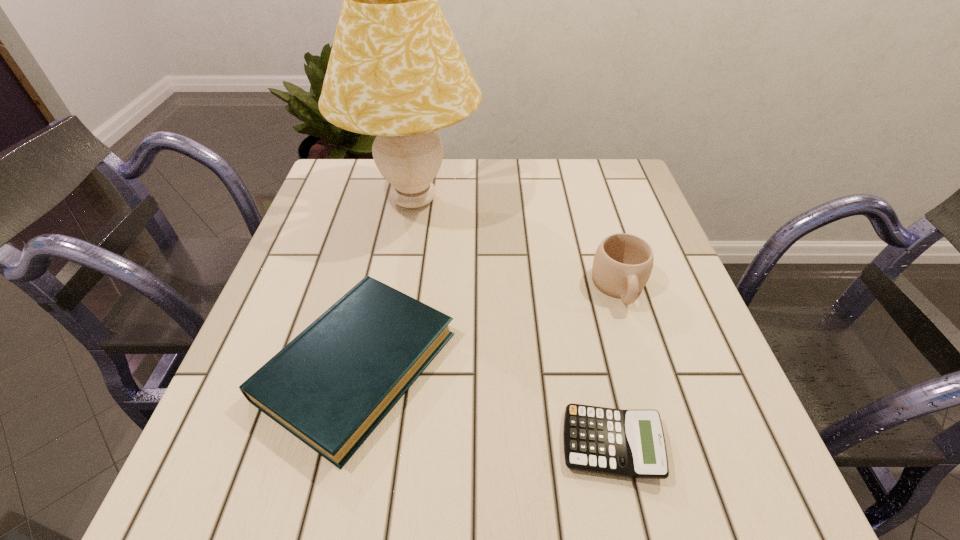
Where is `book present at the near edge`? book present at the near edge is located at coordinates (331, 386).

At what (x,y) coordinates should I click in order to perform the action: click on calculator at the near edge. Please return your answer as a coordinate pair (x, y). Looking at the image, I should click on (626, 443).

The image size is (960, 540). I want to click on lampshade that is at the left edge, so click(395, 71).

The height and width of the screenshot is (540, 960). I want to click on book at the left edge, so click(x=331, y=386).

The height and width of the screenshot is (540, 960). In order to click on mug located at the right edge in this screenshot , I will do `click(622, 265)`.

At what (x,y) coordinates should I click in order to perform the action: click on calculator that is positioned at the right edge. Please return your answer as a coordinate pair (x, y). Image resolution: width=960 pixels, height=540 pixels. Looking at the image, I should click on (626, 443).

Locate an element on the screen. The width and height of the screenshot is (960, 540). object present at the far left corner is located at coordinates (395, 71).

Find the location of a particular element. The height and width of the screenshot is (540, 960). object that is positioned at the near left corner is located at coordinates (331, 386).

Identify the location of object located at the near right corner. (626, 443).

I want to click on free space at the far edge of the desktop, so click(x=460, y=171).